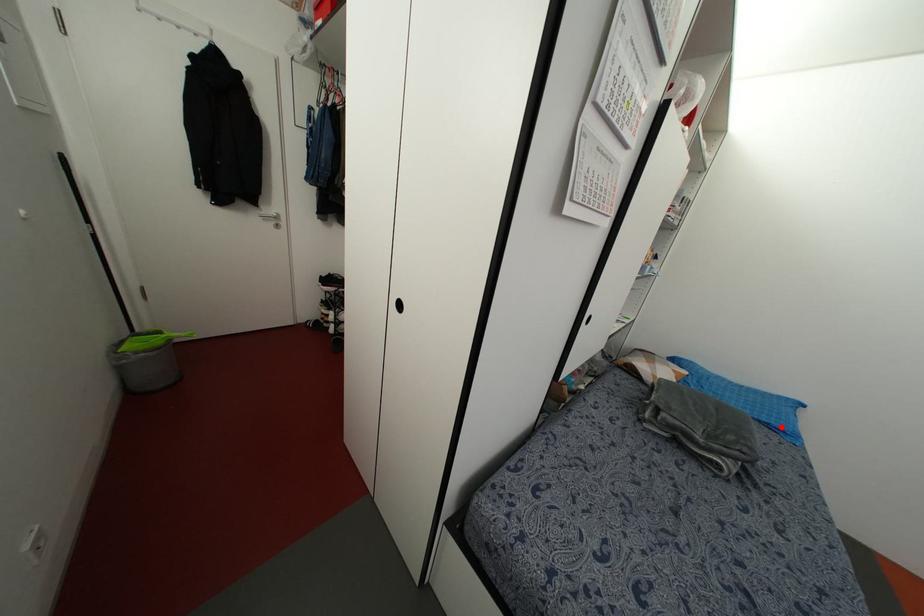
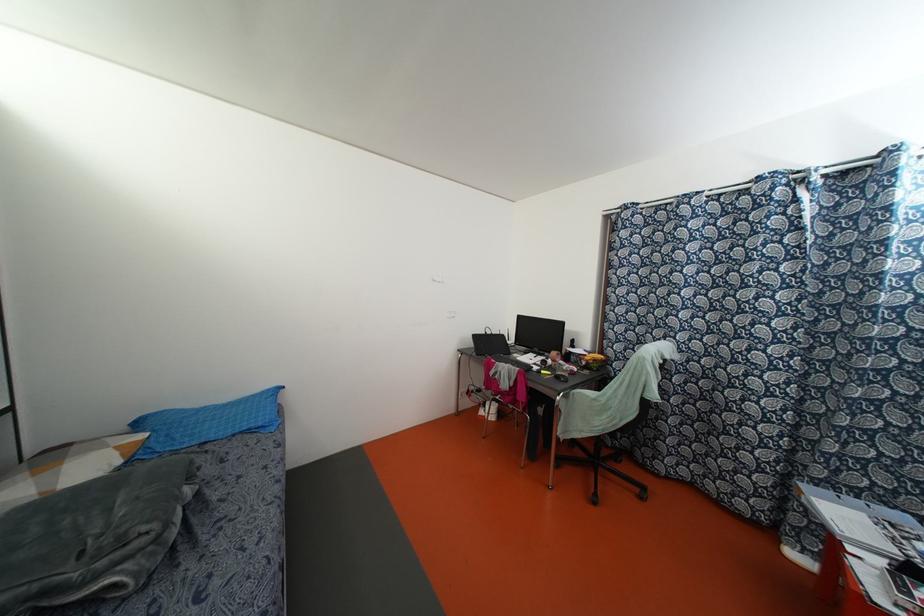
Where in the second image is the point corresponding to the highlighted location from the first image?

(259, 424)